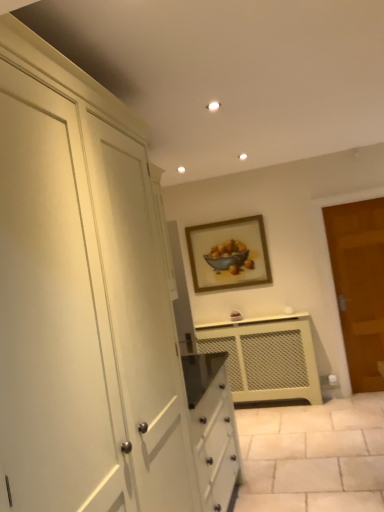
Question: Is matte cream radiator at center taller or shorter than brown wooden door at right?

Choices:
 (A) tall
 (B) short

Answer: (B)

Question: In the image, is matte cream radiator at center positioned in front of or behind brown wooden door at right?

Choices:
 (A) front
 (B) behind

Answer: (B)

Question: Based on their relative distances, which object is nearer to the matte cream radiator at center?

Choices:
 (A) wooden-framed painting at center
 (B) brown wooden door at right

Answer: (A)

Question: Which object is positioned closest to the matte cream radiator at center?

Choices:
 (A) wooden-framed painting at center
 (B) brown wooden door at right

Answer: (A)